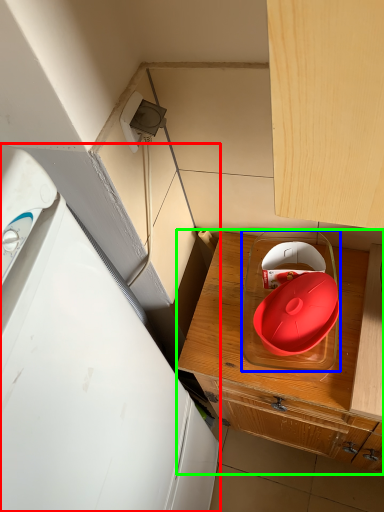
Question: Which object is the closest to the home appliance (highlighted by a red box)? Choose among these: appliance (highlighted by a blue box) or cabinetry (highlighted by a green box).

Choices:
 (A) appliance
 (B) cabinetry

Answer: (B)